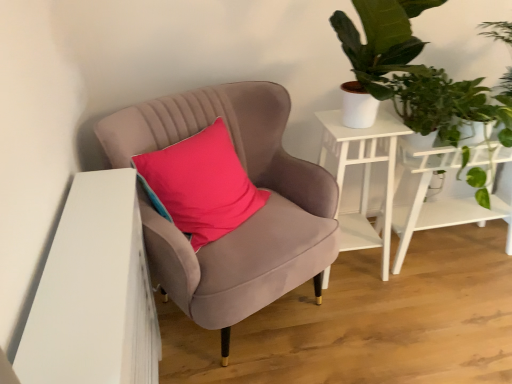
Find the location of `free spot in front of white wood side table at upper right, arranged as the 1th table when viewed from the left`. free spot in front of white wood side table at upper right, arranged as the 1th table when viewed from the left is located at coordinates (362, 310).